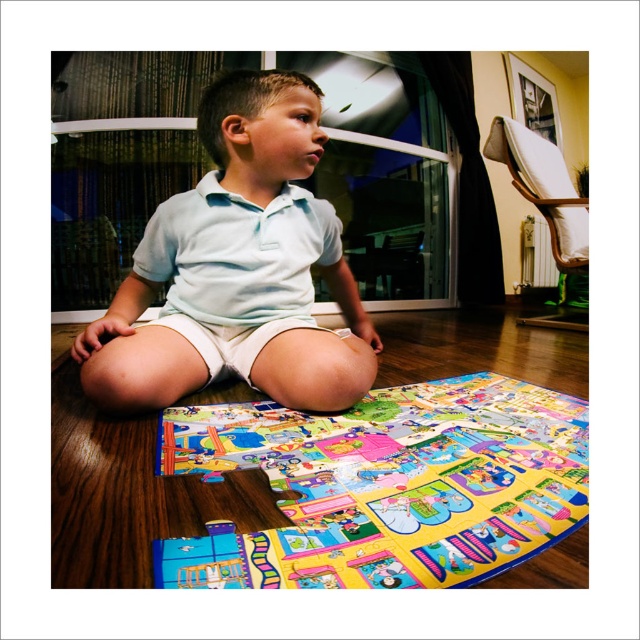
Between point (390, 497) and point (198, 115), which one is positioned in front?

Positioned in front is point (390, 497).

This screenshot has height=640, width=640. In order to click on colorful plastic puzzle at lower center in this screenshot , I will do `click(387, 484)`.

Where is `colorful plastic puzzle at lower center`? This screenshot has width=640, height=640. colorful plastic puzzle at lower center is located at coordinates (387, 484).